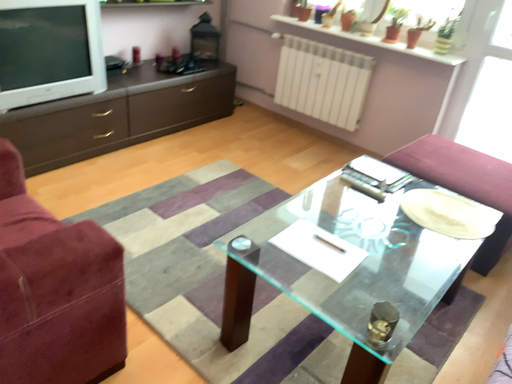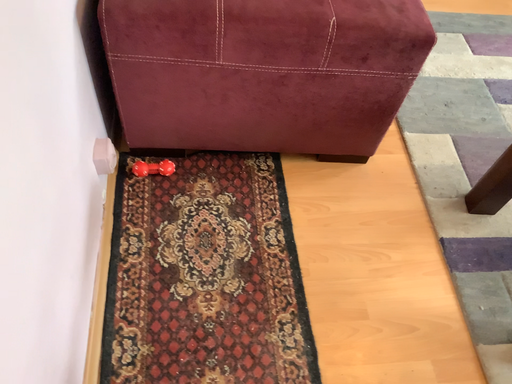
Question: How did the camera likely rotate when shooting the video?

Choices:
 (A) rotated left
 (B) rotated right

Answer: (A)